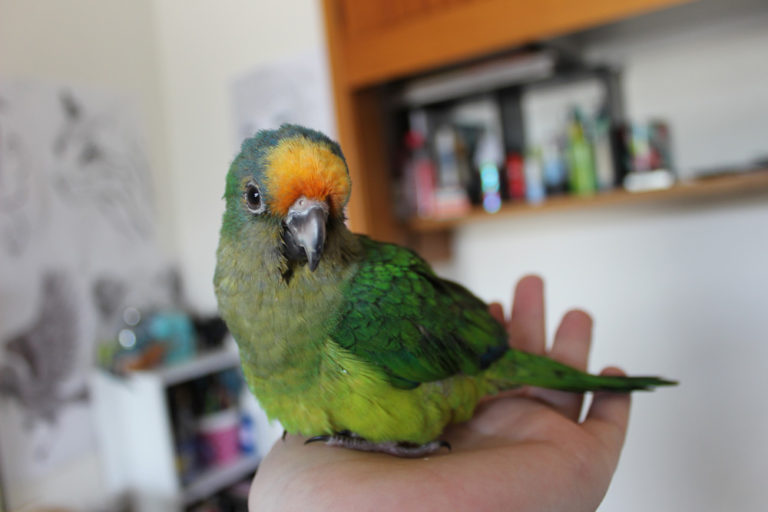
In order to click on shelf in this screenshot , I will do `click(680, 192)`.